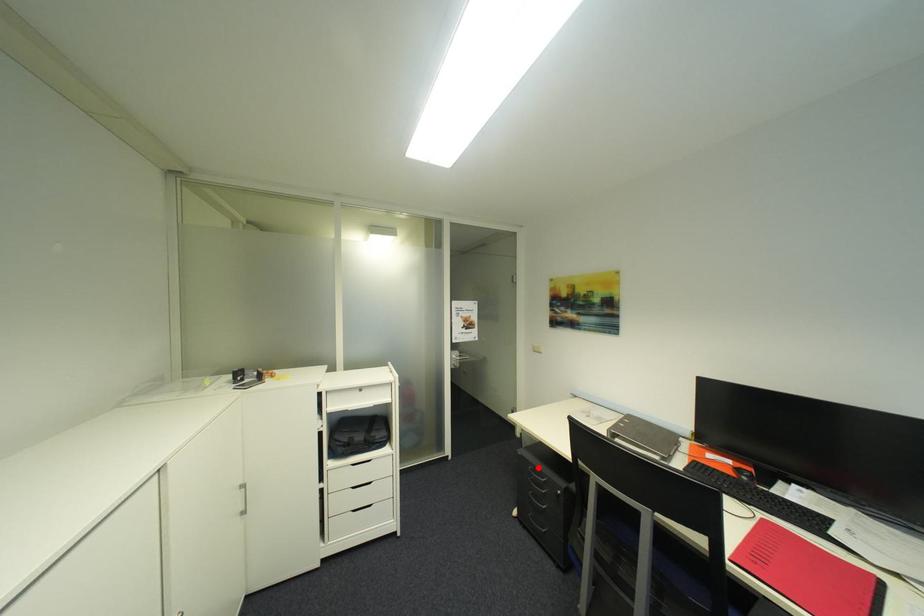
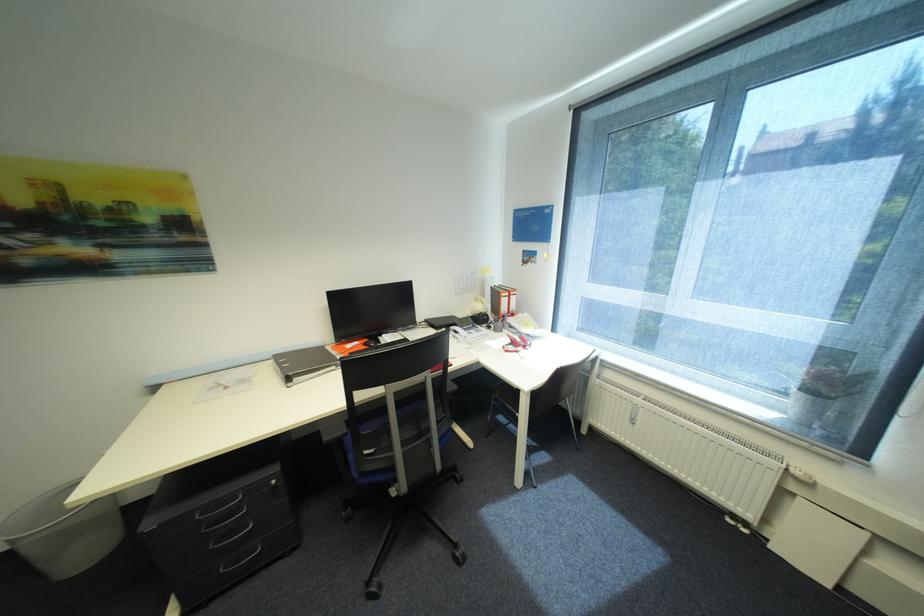
In the second image, find the point that corresponds to the highlighted location in the first image.

(205, 516)